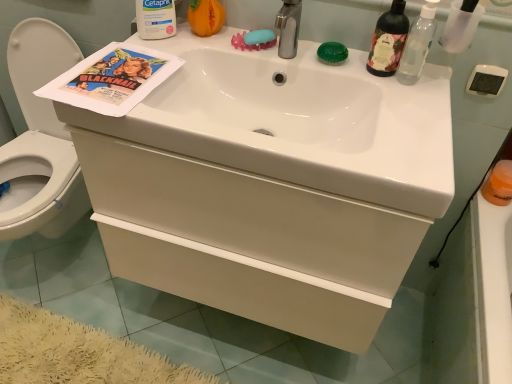
Measure the distance between green translucent soap at upper center, which is counted as the 1th soap, starting from the right, and camera.

green translucent soap at upper center, which is counted as the 1th soap, starting from the right, is 3.56 feet from camera.

Find the location of a particular element. white matte drawer at center is located at coordinates (252, 217).

Where is `blue rubber soap at upper center, which ranks as the 2th soap in right-to-left order`? blue rubber soap at upper center, which ranks as the 2th soap in right-to-left order is located at coordinates (259, 36).

Based on the photo, how much space does translucent glass bottle at upper right, the second bottle in the left-to-right sequence, occupy vertically?

The height of translucent glass bottle at upper right, the second bottle in the left-to-right sequence, is 7.54 inches.

I want to click on orange plastic cup at right, so click(x=499, y=184).

Considering the relative positions of green translucent soap at upper center, the second soap viewed from the left, and orange plastic cup at right in the image provided, is green translucent soap at upper center, the second soap viewed from the left, in front of orange plastic cup at right?

Yes.

Looking at this image, can you confirm if green translucent soap at upper center, the second soap viewed from the left, is bigger than orange plastic cup at right?

Incorrect, green translucent soap at upper center, the second soap viewed from the left, is not larger than orange plastic cup at right.

The image size is (512, 384). In order to click on mouthwash behind the green translucent soap at upper center, which is counted as the 1th soap, starting from the right in this screenshot , I will do `click(499, 184)`.

From the image's perspective, which is above, green translucent soap at upper center, which is counted as the 1th soap, starting from the right, or transparent plastic bottle at upper right, the 1th bottle from the right?

green translucent soap at upper center, which is counted as the 1th soap, starting from the right, from the image's perspective.

Between green translucent soap at upper center, which is counted as the 1th soap, starting from the right, and transparent plastic bottle at upper right, which is counted as the third bottle, starting from the left, which one has smaller width?

transparent plastic bottle at upper right, which is counted as the third bottle, starting from the left.

Is green translucent soap at upper center, which is counted as the 1th soap, starting from the right, bigger than transparent plastic bottle at upper right, the 1th bottle from the right?

No.

Is green translucent soap at upper center, the second soap viewed from the left, facing towards transparent plastic bottle at upper right, the 1th bottle from the right?

No, green translucent soap at upper center, the second soap viewed from the left, is not oriented towards transparent plastic bottle at upper right, the 1th bottle from the right.

Is translucent glass bottle at upper right, the second bottle in the left-to-right sequence, not within white matte drawer at center?

Yes, translucent glass bottle at upper right, the second bottle in the left-to-right sequence, is located beyond the bounds of white matte drawer at center.

Considering the sizes of translucent glass bottle at upper right, which is the 2th bottle in right-to-left order, and white matte drawer at center in the image, is translucent glass bottle at upper right, which is the 2th bottle in right-to-left order, taller or shorter than white matte drawer at center?

translucent glass bottle at upper right, which is the 2th bottle in right-to-left order, is shorter than white matte drawer at center.

Is translucent glass bottle at upper right, which is the 2th bottle in right-to-left order, facing away from white matte drawer at center?

That's not correct — translucent glass bottle at upper right, which is the 2th bottle in right-to-left order, is not looking away from white matte drawer at center.

Which is behind, translucent glass bottle at upper right, which is the 2th bottle in right-to-left order, or white matte drawer at center?

translucent glass bottle at upper right, which is the 2th bottle in right-to-left order, is behind.

What's the angular difference between white matte lotion at upper center, positioned as the 1th bottle in left-to-right order, and translucent glass bottle at upper right, which is the 2th bottle in right-to-left order,'s facing directions?

There is a 39.5-degree angle between the facing directions of white matte lotion at upper center, positioned as the 1th bottle in left-to-right order, and translucent glass bottle at upper right, which is the 2th bottle in right-to-left order.

Is white matte lotion at upper center, positioned as the 1th bottle in left-to-right order, facing towards translucent glass bottle at upper right, the second bottle in the left-to-right sequence?

No, white matte lotion at upper center, positioned as the 1th bottle in left-to-right order, is not aimed at translucent glass bottle at upper right, the second bottle in the left-to-right sequence.

Considering the relative positions of white matte lotion at upper center, which is counted as the 3th bottle, starting from the right, and translucent glass bottle at upper right, which is the 2th bottle in right-to-left order, in the image provided, is white matte lotion at upper center, which is counted as the 3th bottle, starting from the right, in front of translucent glass bottle at upper right, which is the 2th bottle in right-to-left order,?

No, white matte lotion at upper center, which is counted as the 3th bottle, starting from the right, is further to the viewer.

Which is more to the right, white matte lotion at upper center, which is counted as the 3th bottle, starting from the right, or translucent glass bottle at upper right, which is the 2th bottle in right-to-left order?

Positioned to the right is translucent glass bottle at upper right, which is the 2th bottle in right-to-left order.

Does white matte drawer at center touch white glossy toilet at left?

No, white matte drawer at center is not in contact with white glossy toilet at left.

From a real-world perspective, does white matte drawer at center stand above white glossy toilet at left?

Yes, from a real-world perspective, white matte drawer at center is on top of white glossy toilet at left.

Looking at this image, is white matte drawer at center outside of white glossy toilet at left?

Absolutely, white matte drawer at center is external to white glossy toilet at left.

Which is more distant, (402, 40) or (411, 79)?

Point (411, 79)

Can you tell me how much translucent glass bottle at upper right, which is the 2th bottle in right-to-left order, and transparent plastic bottle at upper right, the 1th bottle from the right, differ in facing direction?

0.000222 degrees separate the facing orientations of translucent glass bottle at upper right, which is the 2th bottle in right-to-left order, and transparent plastic bottle at upper right, the 1th bottle from the right.

Which object is wider, translucent glass bottle at upper right, the second bottle in the left-to-right sequence, or transparent plastic bottle at upper right, which is counted as the third bottle, starting from the left?

With larger width is translucent glass bottle at upper right, the second bottle in the left-to-right sequence.

Is translucent glass bottle at upper right, the second bottle in the left-to-right sequence, bigger than transparent plastic bottle at upper right, the 1th bottle from the right?

Yes.

Is orange plastic cup at right inside the boundaries of transparent plastic bottle at upper right, the 1th bottle from the right, or outside?

orange plastic cup at right cannot be found inside transparent plastic bottle at upper right, the 1th bottle from the right.

How different are the orientations of orange plastic cup at right and transparent plastic bottle at upper right, which is counted as the third bottle, starting from the left, in degrees?

0.0575 degrees separate the facing orientations of orange plastic cup at right and transparent plastic bottle at upper right, which is counted as the third bottle, starting from the left.

Based on their sizes in the image, would you say orange plastic cup at right is bigger or smaller than transparent plastic bottle at upper right, the 1th bottle from the right?

Clearly, orange plastic cup at right is larger in size than transparent plastic bottle at upper right, the 1th bottle from the right.

From the picture: Considering the relative positions of orange plastic cup at right and transparent plastic bottle at upper right, the 1th bottle from the right, in the image provided, is orange plastic cup at right to the left of transparent plastic bottle at upper right, the 1th bottle from the right, from the viewer's perspective?

In fact, orange plastic cup at right is to the right of transparent plastic bottle at upper right, the 1th bottle from the right.

At what (x,y) coordinates should I click in order to perform the action: click on the 2nd soap in front of the orange plastic cup at right, counting from the anchor's position. Please return your answer as a coordinate pair (x, y). The width and height of the screenshot is (512, 384). Looking at the image, I should click on (332, 53).

Where is `the 2nd soap below the transparent plastic bottle at upper right, the 1th bottle from the right (from a real-world perspective)`? the 2nd soap below the transparent plastic bottle at upper right, the 1th bottle from the right (from a real-world perspective) is located at coordinates (332, 53).

Based on their spatial positions, is white matte drawer at center or matte paper poster at upper left closer to transparent plastic bottle at upper right, which is counted as the third bottle, starting from the left?

white matte drawer at center.

When comparing their distances from white matte lotion at upper center, which is counted as the 3th bottle, starting from the right, does green translucent soap at upper center, the second soap viewed from the left, or translucent glass bottle at upper right, which is the 2th bottle in right-to-left order, seem closer?

green translucent soap at upper center, the second soap viewed from the left, is positioned closer to the anchor white matte lotion at upper center, which is counted as the 3th bottle, starting from the right.

Looking at the image, which one is located further to white matte drawer at center, transparent plastic bottle at upper right, which is counted as the third bottle, starting from the left, or white matte lotion at upper center, positioned as the 1th bottle in left-to-right order?

transparent plastic bottle at upper right, which is counted as the third bottle, starting from the left, lies further to white matte drawer at center than the other object.

Estimate the real-world distances between objects in this image. Which object is closer to blue rubber soap at upper center, which ranks as the 2th soap in right-to-left order, translucent glass bottle at upper right, the second bottle in the left-to-right sequence, or transparent plastic bottle at upper right, the 1th bottle from the right?

translucent glass bottle at upper right, the second bottle in the left-to-right sequence, is positioned closer to the anchor blue rubber soap at upper center, which ranks as the 2th soap in right-to-left order.

From the image, which object appears to be farther from translucent glass bottle at upper right, the second bottle in the left-to-right sequence, matte paper poster at upper left or green translucent soap at upper center, the second soap viewed from the left?

matte paper poster at upper left lies further to translucent glass bottle at upper right, the second bottle in the left-to-right sequence, than the other object.

Looking at the image, which one is located further to orange plastic cup at right, white glossy toilet at left or white matte drawer at center?

Based on the image, white glossy toilet at left appears to be further to orange plastic cup at right.

Based on the photo, estimate the real-world distances between objects in this image. Which object is closer to white matte lotion at upper center, which is counted as the 3th bottle, starting from the right, green translucent soap at upper center, the second soap viewed from the left, or white glossy sink at center?

white glossy sink at center is closer to white matte lotion at upper center, which is counted as the 3th bottle, starting from the right.

In the scene shown: Estimate the real-world distances between objects in this image. Which object is closer to transparent plastic bottle at upper right, which is counted as the third bottle, starting from the left, orange plastic cup at right or white matte lotion at upper center, positioned as the 1th bottle in left-to-right order?

The object closer to transparent plastic bottle at upper right, which is counted as the third bottle, starting from the left, is orange plastic cup at right.

Identify the location of bottle between white glossy toilet at left and blue rubber soap at upper center, which ranks as the 2th soap in right-to-left order, in the horizontal direction. (155, 18).

Identify the location of soap situated between white glossy sink at center and orange plastic cup at right from left to right. (332, 53).

The height and width of the screenshot is (384, 512). Identify the location of sink between white matte lotion at upper center, which is counted as the 3th bottle, starting from the right, and white matte drawer at center, in the vertical direction. [297, 121].

Find the location of `sink between blue rubber soap at upper center, the 1th soap positioned from the left, and orange plastic cup at right, in the horizontal direction`. sink between blue rubber soap at upper center, the 1th soap positioned from the left, and orange plastic cup at right, in the horizontal direction is located at coordinates (297, 121).